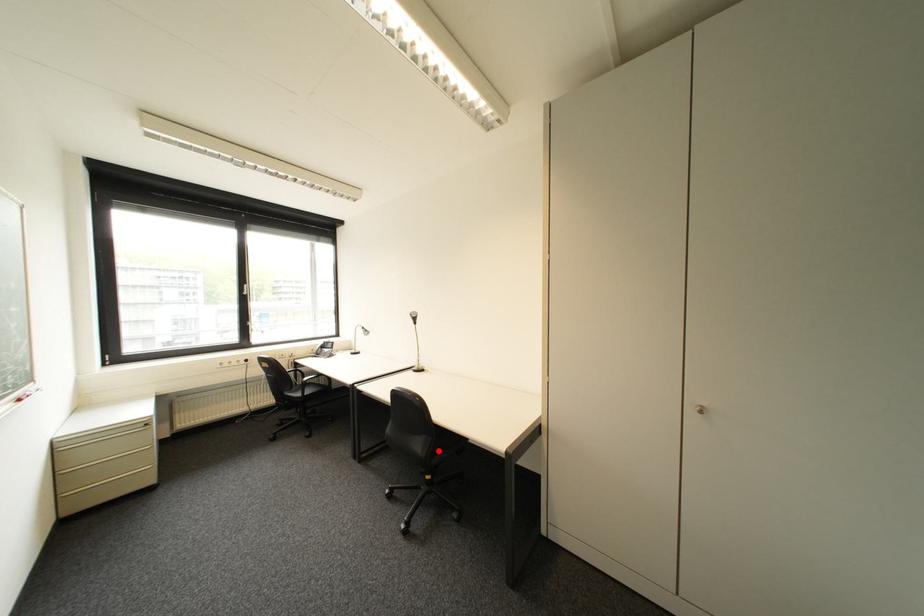
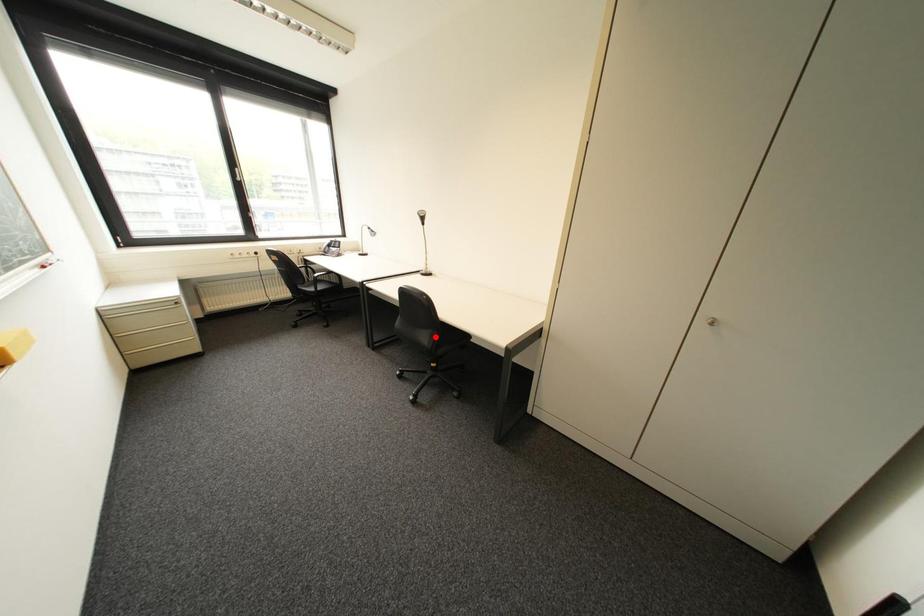
I am providing you with two images of the same scene from different viewpoints. A red point is marked on the first image and another point is marked on the second image. Is the red point in image1 aligned with the point shown in image2?

No